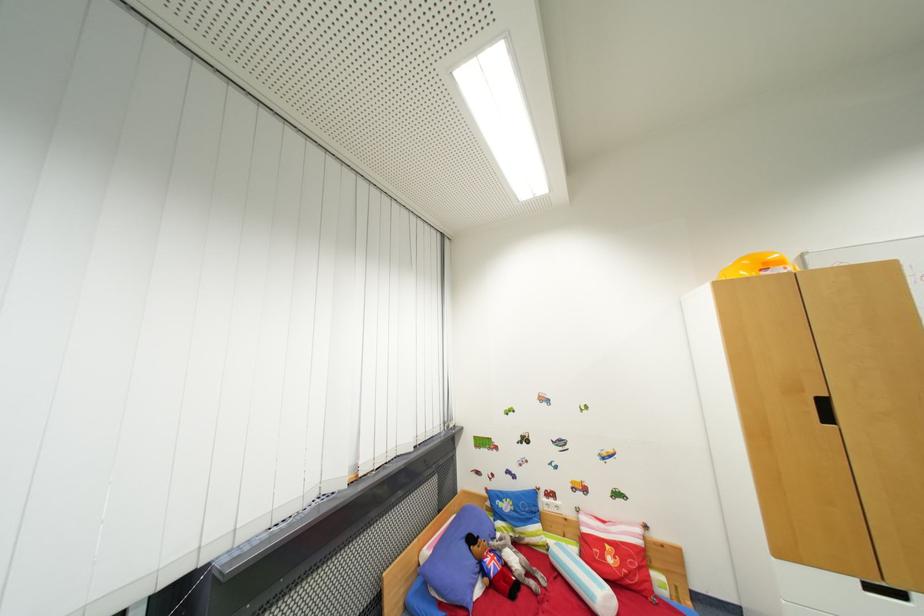
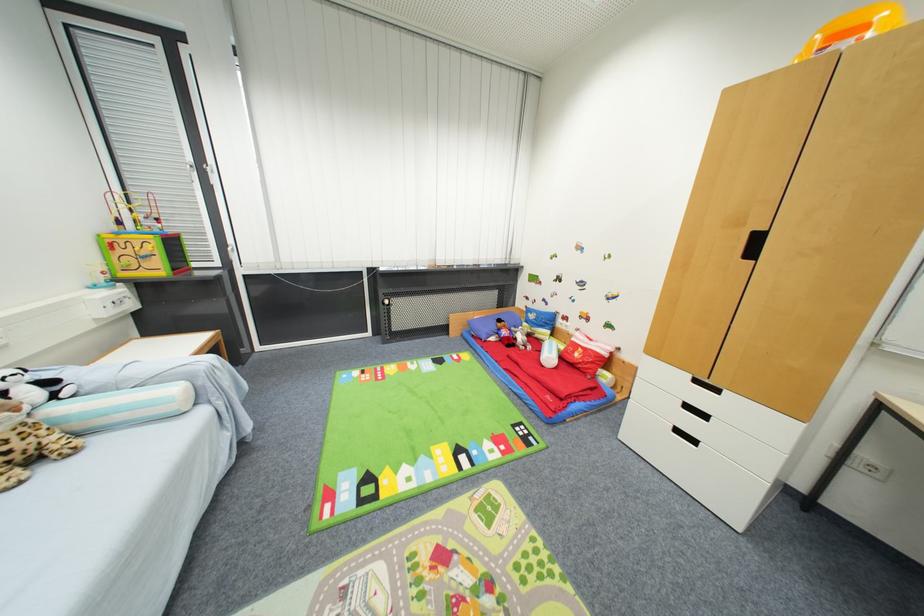
Find the pixel in the second image that matches the point at 833,419 in the first image.

(757, 254)